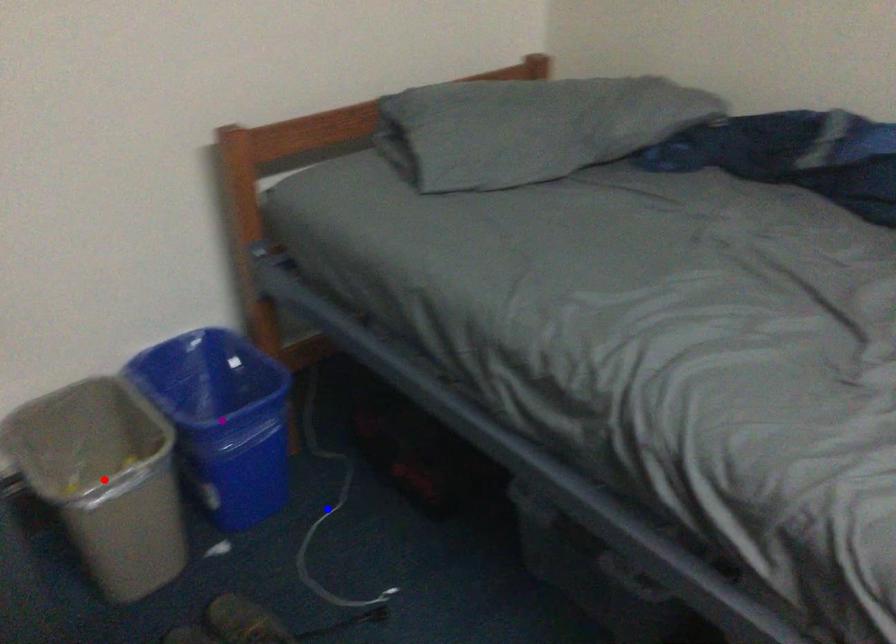
Order these from farthest to nearest:
1. red point
2. purple point
3. blue point

blue point → purple point → red point